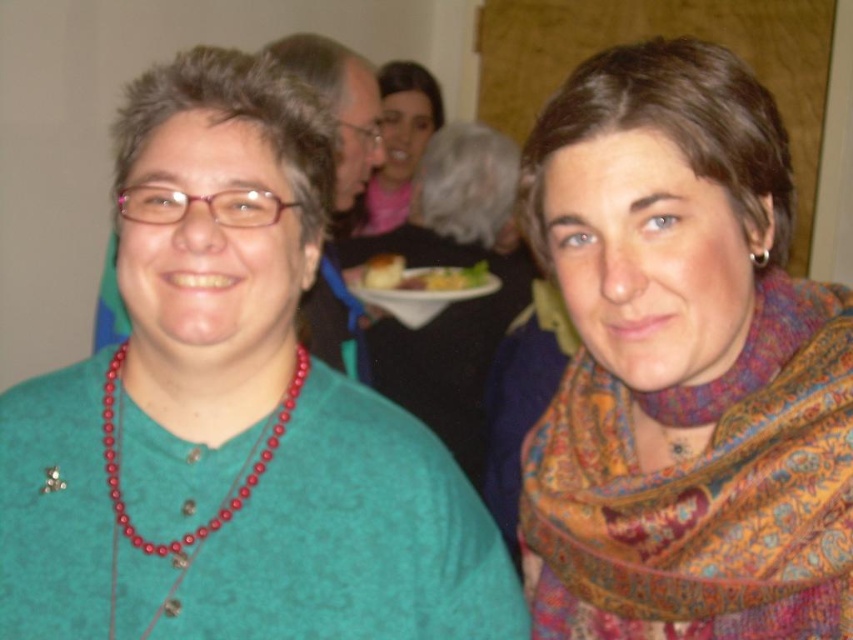
Looking at this image, you are at a party and need to place a dessert on the white glossy plate at center. The floral silk scarf at right is on a table. Can you reach the plate without moving the scarf?

The floral silk scarf at right is 3.42 feet away from the white glossy plate at center, so you can reach the plate without moving the scarf as they are separated by sufficient distance.

Consider the image. You are a photographer at the event and need to capture a clear photo of the matte red beaded necklace at center and the white glossy plate at center. Which object should you focus on first to ensure both are in focus?

The matte red beaded necklace at center is in front of the white glossy plate at center, so you should focus on the matte red beaded necklace at center first to ensure both are in focus.